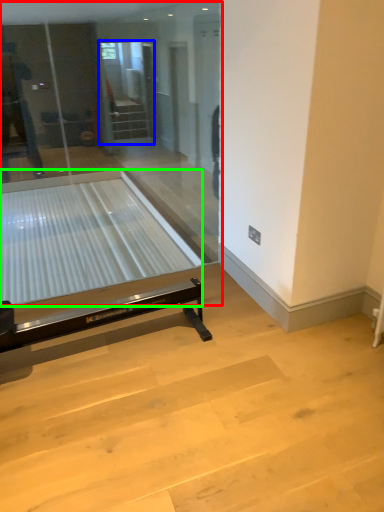
Question: Estimate the real-world distances between objects in this image. Which object is closer to glass door (highlighted by a red box), screen door (highlighted by a blue box) or glass table (highlighted by a green box)?

Choices:
 (A) screen door
 (B) glass table

Answer: (B)